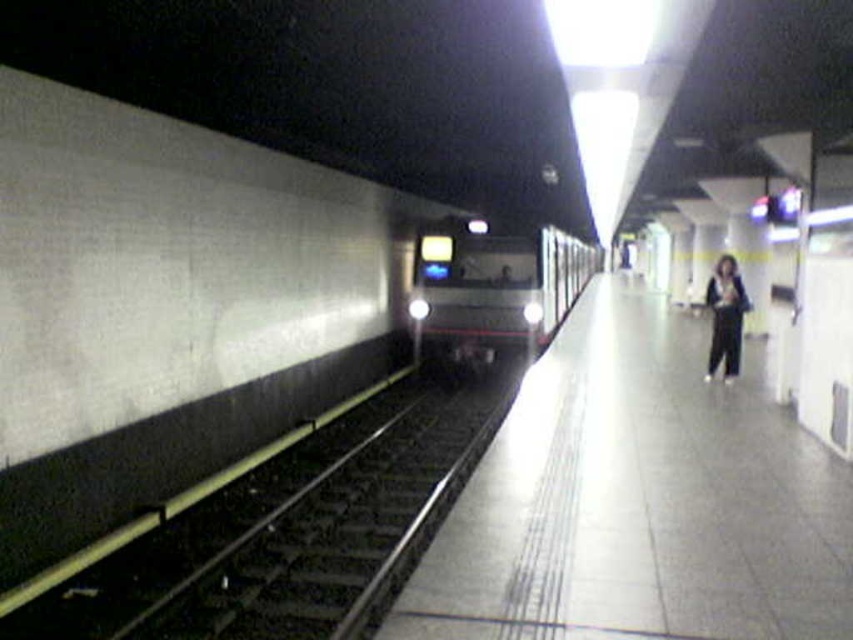
You are a commuter waiting on the subway platform. You notice the black metal train track at center and the metallic silver train at center. Which object takes up more space in the image?

The metallic silver train at center occupies more space than the black metal train track at center, so the metallic silver train at center takes up more space in the image.

You are a passenger waiting at the subway station. You see the smooth concrete platform at center and the metallic silver train at center. Which object is positioned to the right side from your perspective?

The smooth concrete platform at center is positioned to the right of the metallic silver train at center.

Looking at this image, you are a maintenance worker standing on the subway platform and need to inspect the black metal train track at center. Considering your ladder is 5 meters long, will it reach the track from where you are standing?

The black metal train track at center is 5.89 meters from viewer. Since the ladder is only 5 meters long, it is not long enough to reach the track from your current position.